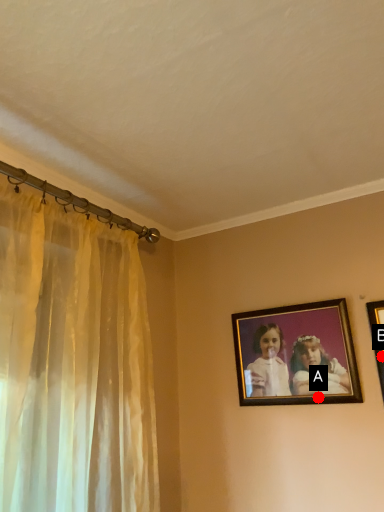
Question: Two points are circled on the image, labeled by A and B beside each circle. Among these points, which one is farthest from the camera?

Choices:
 (A) A is further
 (B) B is further

Answer: (A)